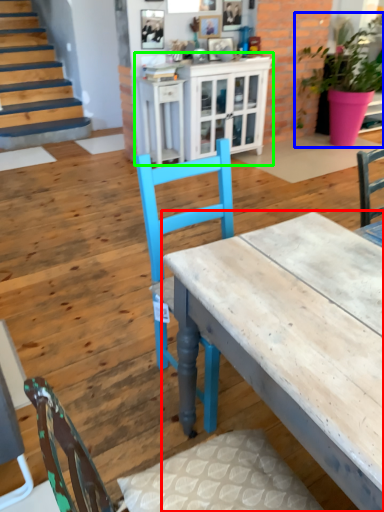
Question: Based on their relative distances, which object is farther from desk (highlighted by a red box)? Choose from houseplant (highlighted by a blue box) and cabinetry (highlighted by a green box).

Choices:
 (A) houseplant
 (B) cabinetry

Answer: (A)